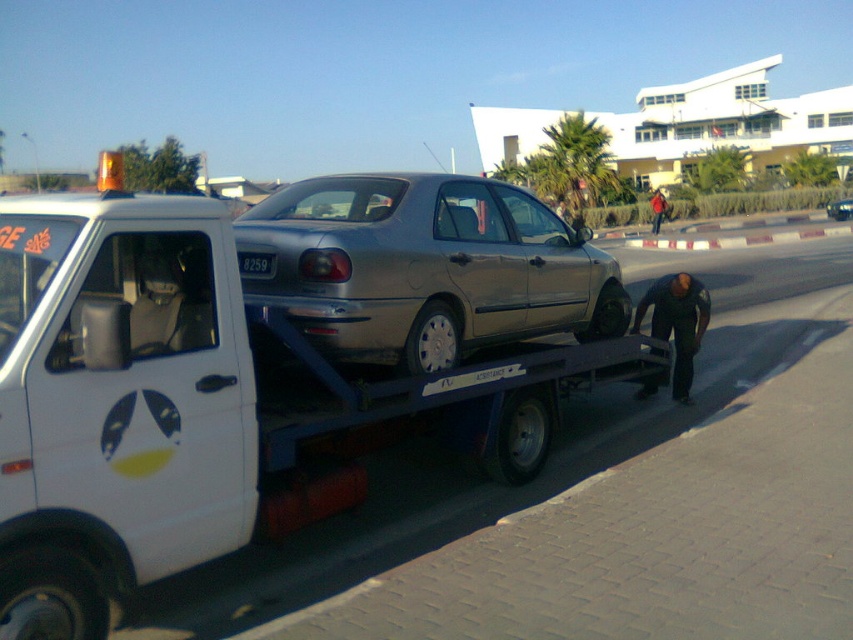
You are a driver who needs to unload the satin silver car at center from the white matte tow truck at center. Based on the scene, which vehicle should you start moving first?

The white matte tow truck at center is positioned over the satin silver car at center, so you should move the white matte tow truck at center first to allow access to the satin silver car at center.

Consider the image. You are a pedestrian trying to cross the street safely. You see the white matte tow truck at center and the dark brown leather jacket at lower right. Which object is closer to the right side of the image?

The dark brown leather jacket at lower right is closer to the right side of the image because it is positioned to the right of the white matte tow truck at center.